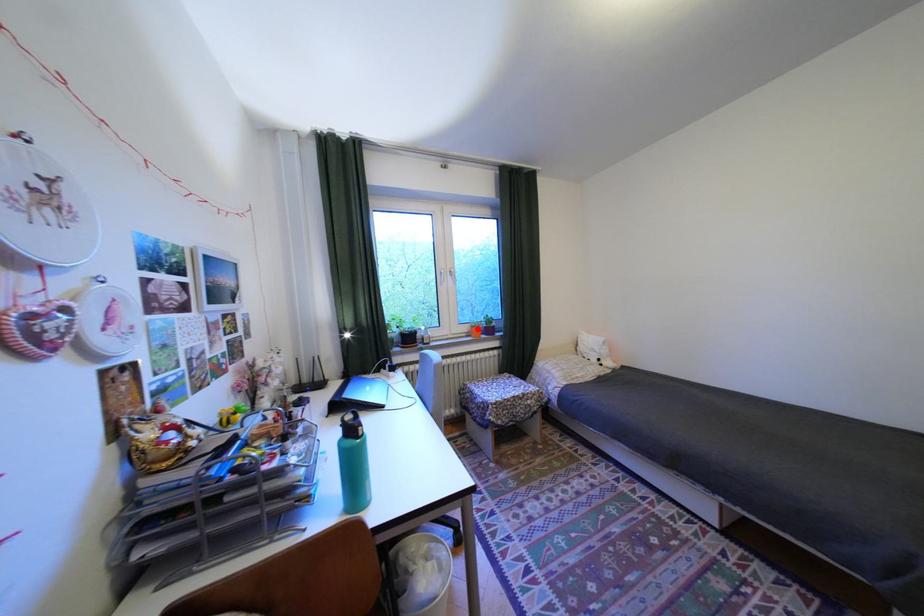
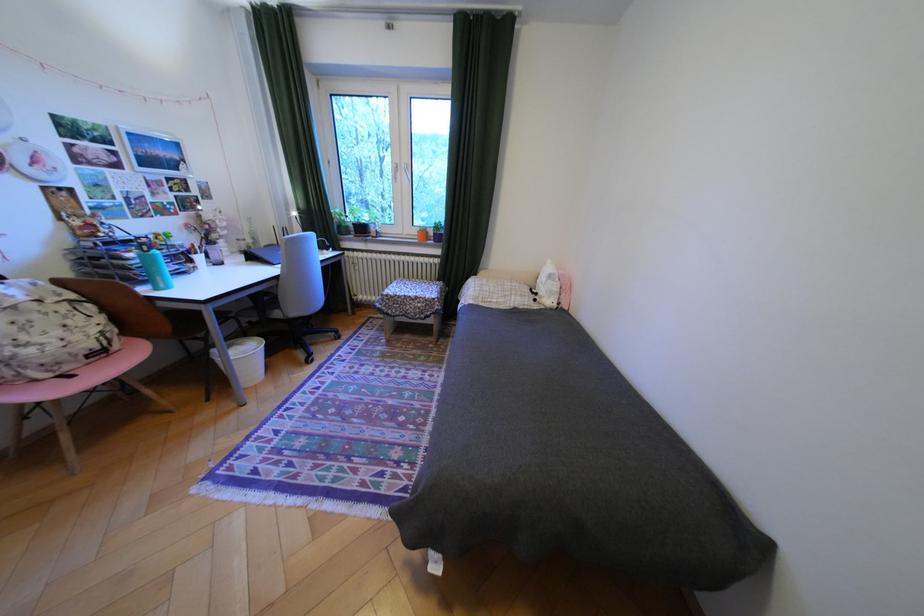
Question: I am providing you with two images of the same scene from different viewpoints. In image1, a red point is highlighted. Considering the same 3D point in image2, which of the following is correct?

Choices:
 (A) It is closer
 (B) It is farther

Answer: (A)